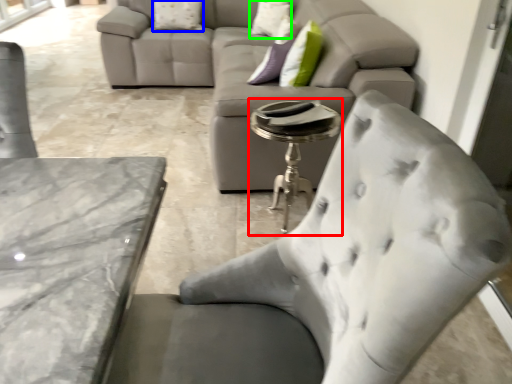
Question: Which object is the farthest from side table (highlighted by a red box)? Choose among these: pillow (highlighted by a blue box) or pillow (highlighted by a green box).

Choices:
 (A) pillow
 (B) pillow

Answer: (A)